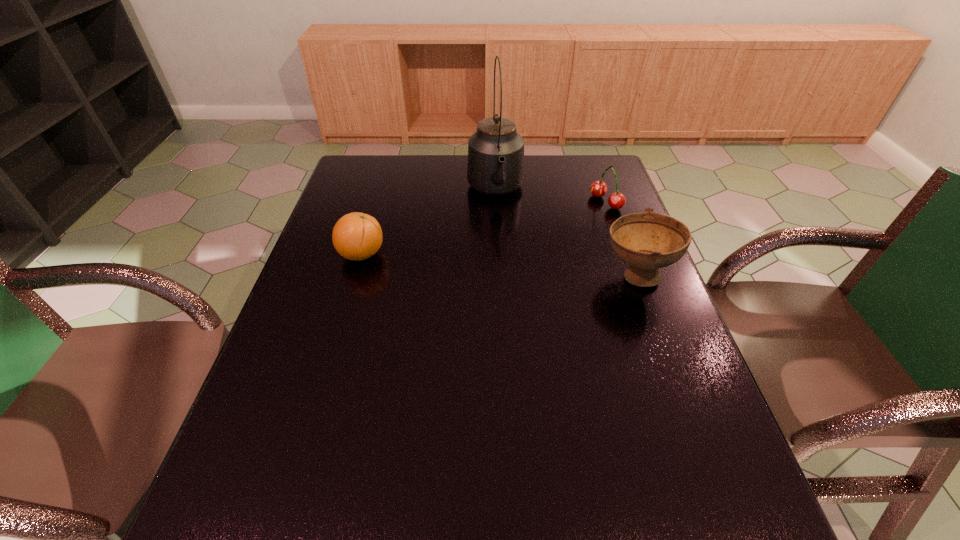
The height and width of the screenshot is (540, 960). I want to click on orange, so click(356, 236).

Locate an element on the screen. The width and height of the screenshot is (960, 540). the second tallest object is located at coordinates (647, 241).

In order to click on cherry in this screenshot , I will do `click(617, 200)`.

Identify the location of the tallest object. The width and height of the screenshot is (960, 540). (495, 166).

Find the location of a particular element. The width and height of the screenshot is (960, 540). the second object from left to right is located at coordinates (495, 166).

This screenshot has width=960, height=540. Find the location of `vacant region located on the back of the orange`. vacant region located on the back of the orange is located at coordinates (374, 211).

Identify the location of vacant space located 0.070m on the front of the soup bowl. This screenshot has width=960, height=540. (654, 325).

At what (x,y) coordinates should I click in order to perform the action: click on free location located with stems pointing upwards on the cherry. Please return your answer as a coordinate pair (x, y). Looking at the image, I should click on (x=496, y=247).

Locate an element on the screen. Image resolution: width=960 pixels, height=540 pixels. vacant space located 0.110m with stems pointing upwards on the cherry is located at coordinates (566, 219).

Where is `free space located with stems pointing upwards on the cherry`? free space located with stems pointing upwards on the cherry is located at coordinates click(x=553, y=224).